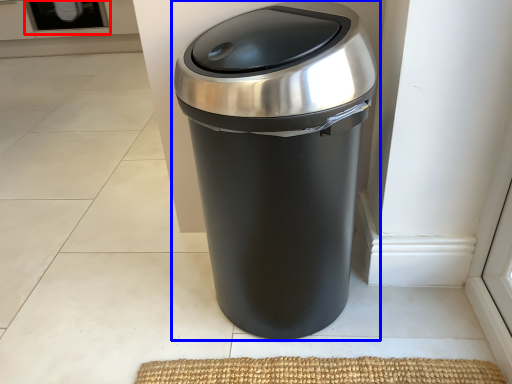
Question: Which object is closer to the camera taking this photo, screen door (highlighted by a red box) or waste container (highlighted by a blue box)?

Choices:
 (A) screen door
 (B) waste container

Answer: (B)